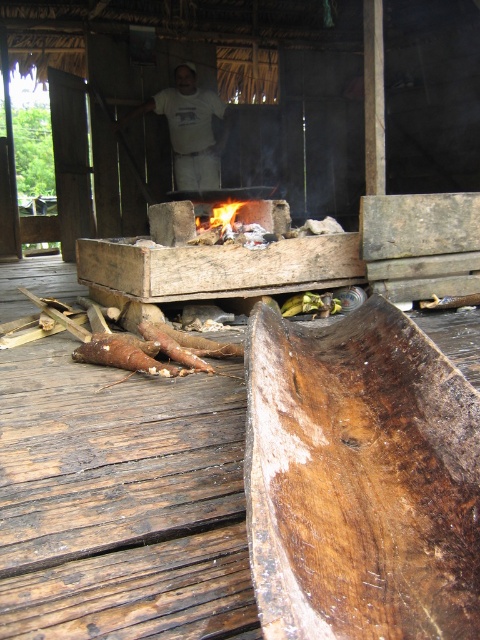
Question: Does white cotton shirt at upper center appear under flame wood fire at center?

Choices:
 (A) yes
 (B) no

Answer: (B)

Question: Is white cotton shirt at upper center below flame wood fire at center?

Choices:
 (A) no
 (B) yes

Answer: (A)

Question: Does white cotton shirt at upper center have a larger size compared to flame wood fire at center?

Choices:
 (A) yes
 (B) no

Answer: (A)

Question: Which point appears closest to the camera in this image?

Choices:
 (A) (235, 216)
 (B) (172, 109)

Answer: (A)

Question: Which object is closer to the camera taking this photo?

Choices:
 (A) flame wood fire at center
 (B) white cotton shirt at upper center

Answer: (A)

Question: Which point is farther to the camera?

Choices:
 (A) white cotton shirt at upper center
 (B) flame wood fire at center

Answer: (A)